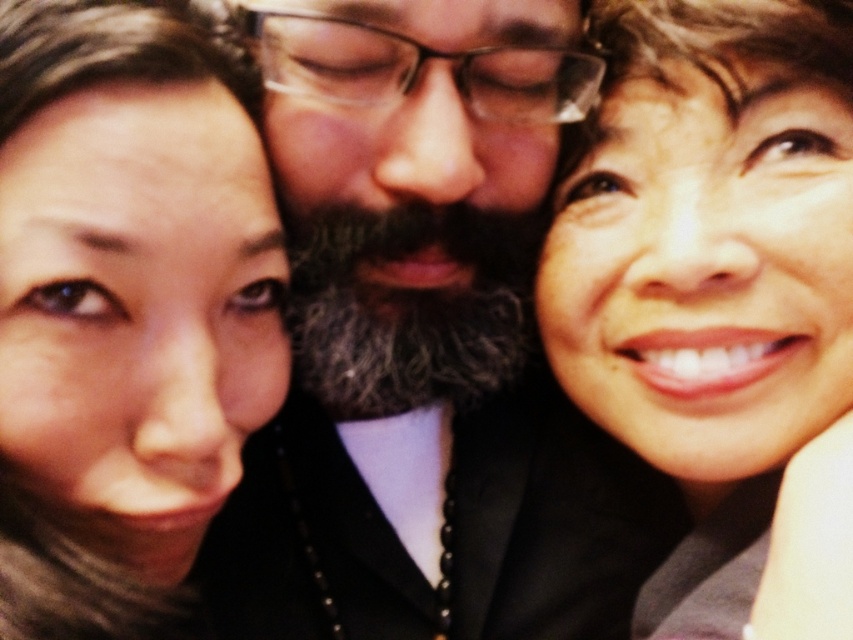
Who is positioned more to the right, gray beard at center or smooth skin face at upper left?

→ From the viewer's perspective, gray beard at center appears more on the right side.

Based on the photo, who is more forward, (380, 353) or (73, 122)?

Point (73, 122) is in front.

Locate an element on the screen. This screenshot has width=853, height=640. gray beard at center is located at coordinates (424, 340).

Is point (521, 488) positioned before point (790, 356)?

That is False.

Locate an element on the screen. The height and width of the screenshot is (640, 853). gray beard at center is located at coordinates (424, 340).

Who is lower down, smooth skin face at upper left or smooth skin face at upper right?

smooth skin face at upper left is lower down.

Between point (67, 532) and point (752, 296), which one is positioned behind?

The point (752, 296) is more distant.

Which is behind, point (74, 452) or point (679, 218)?

The point (679, 218) is behind.

I want to click on smooth skin face at upper left, so click(x=125, y=314).